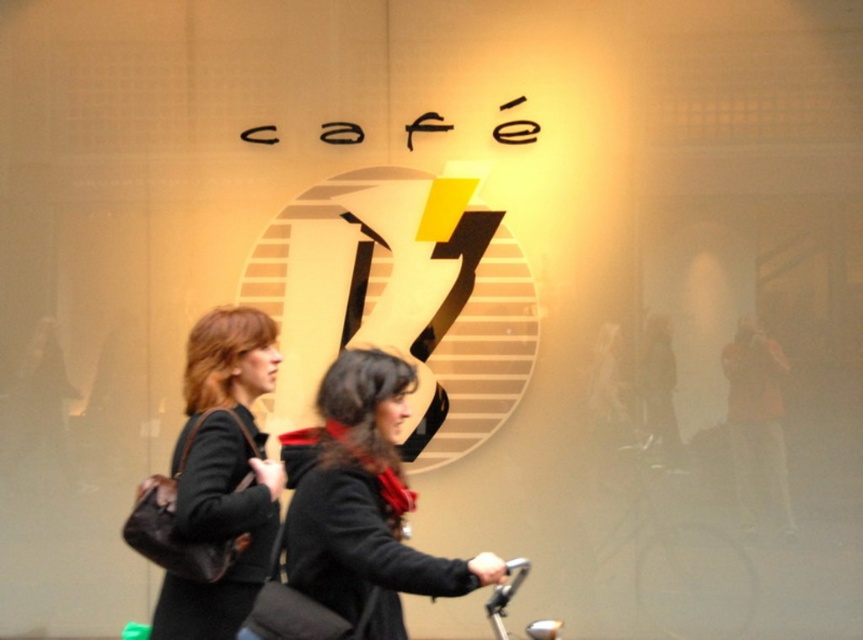
Does black matte jacket at center have a lesser height compared to matte black bag at left?

Correct, black matte jacket at center is not as tall as matte black bag at left.

Is black matte jacket at center to the right of matte black bag at left from the viewer's perspective?

Correct, you'll find black matte jacket at center to the right of matte black bag at left.

Is point (347, 596) positioned before point (238, 314)?

Yes, point (347, 596) is in front of point (238, 314).

Locate an element on the screen. The height and width of the screenshot is (640, 863). black matte jacket at center is located at coordinates (362, 500).